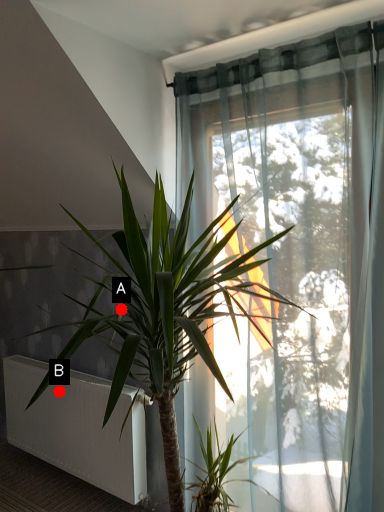
Question: Two points are circled on the image, labeled by A and B beside each circle. Which point is closer to the camera?

Choices:
 (A) A is closer
 (B) B is closer

Answer: (A)